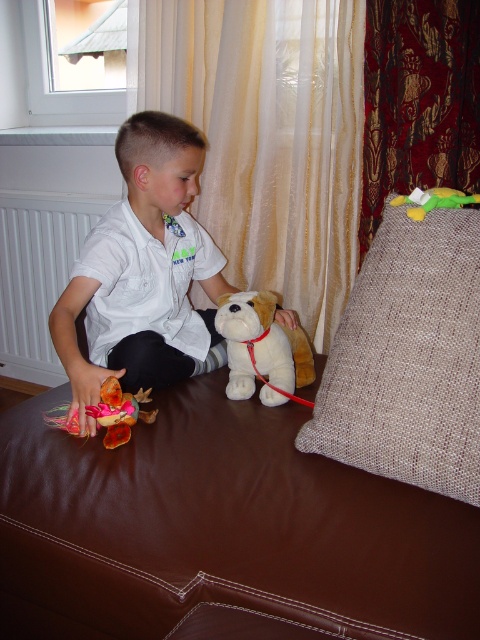
Find the location of a particular element. This screenshot has height=640, width=480. white plush dog at center is located at coordinates (262, 348).

Can you confirm if white plush dog at center is shorter than multicolored fabric doll at lower left?

In fact, white plush dog at center may be taller than multicolored fabric doll at lower left.

Which is behind, point (310, 352) or point (104, 413)?

The point (310, 352) is behind.

You are a GUI agent. You are given a task and a screenshot of the screen. Output one action in this format:
    pyautogui.click(x=<x>, y=<y>)
    Task: Click on the white plush dog at center
    
    Given the screenshot: What is the action you would take?
    pyautogui.click(x=262, y=348)

Is beige textured pillow at upper right smaller than white plush dog at center?

Actually, beige textured pillow at upper right might be larger than white plush dog at center.

Based on the photo, who is shorter, beige textured pillow at upper right or white plush dog at center?

Standing shorter between the two is white plush dog at center.

Does point (417, 394) lie in front of point (228, 356)?

Yes, point (417, 394) is closer to viewer.

This screenshot has width=480, height=640. I want to click on beige textured pillow at upper right, so click(408, 358).

Can you confirm if beige textured pillow at upper right is positioned to the left of multicolored fabric doll at lower left?

No, beige textured pillow at upper right is not to the left of multicolored fabric doll at lower left.

Which is below, beige textured pillow at upper right or multicolored fabric doll at lower left?

Positioned lower is multicolored fabric doll at lower left.

Does point (398, 316) come farther from viewer compared to point (108, 404)?

No.

The width and height of the screenshot is (480, 640). Identify the location of beige textured pillow at upper right. (408, 358).